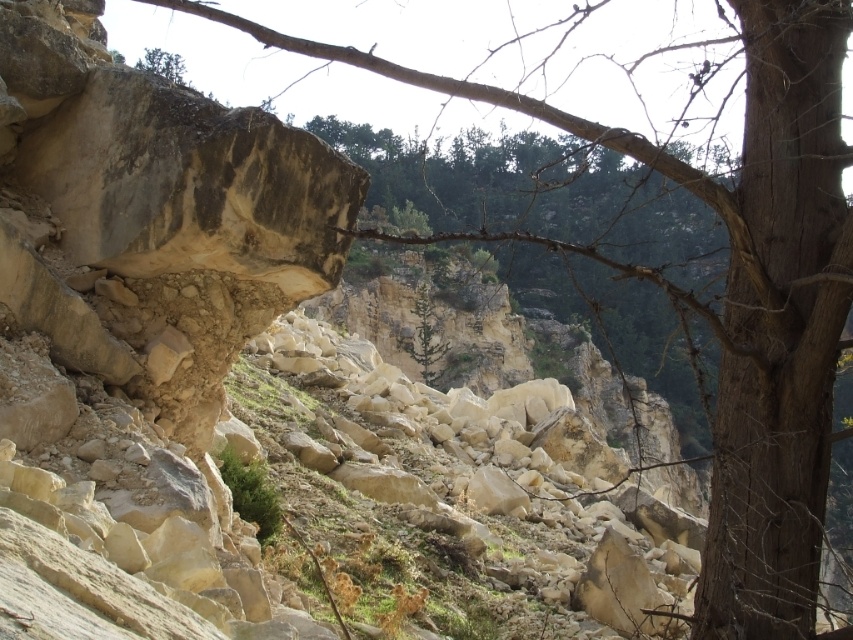
You are standing on the rugged terrain and see a point marked at coordinates [138,323]. What type of rock formation is located at this point?

The point at [138,323] marks a smooth beige rock at center.

You are a hiker trying to reach the green matte tree at center. There is a smooth beige rock at center blocking your path. Can you walk around it to get to the tree?

The smooth beige rock at center is in front of the green matte tree at center, so you can walk around the rock to reach the tree since it is blocking the direct path but not the entire area around it.

You are standing at the point with coordinates point (430, 372) and want to walk to the point (50, 92). Based on the scene description, will you have to climb over any large rocks along the way?

Point (50, 92) is in front of point (430, 372), so you would be moving towards the point (50, 92) which is closer to the foreground. Since the foreground has a large weathered rock formation with uneven shapes and eroded surfaces, you may encounter large rocks to climb over along the way.